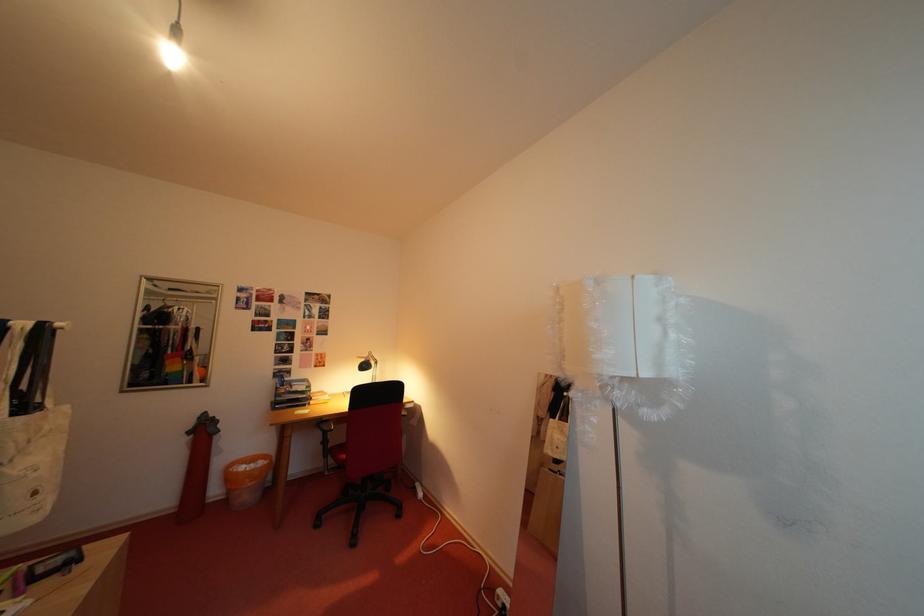
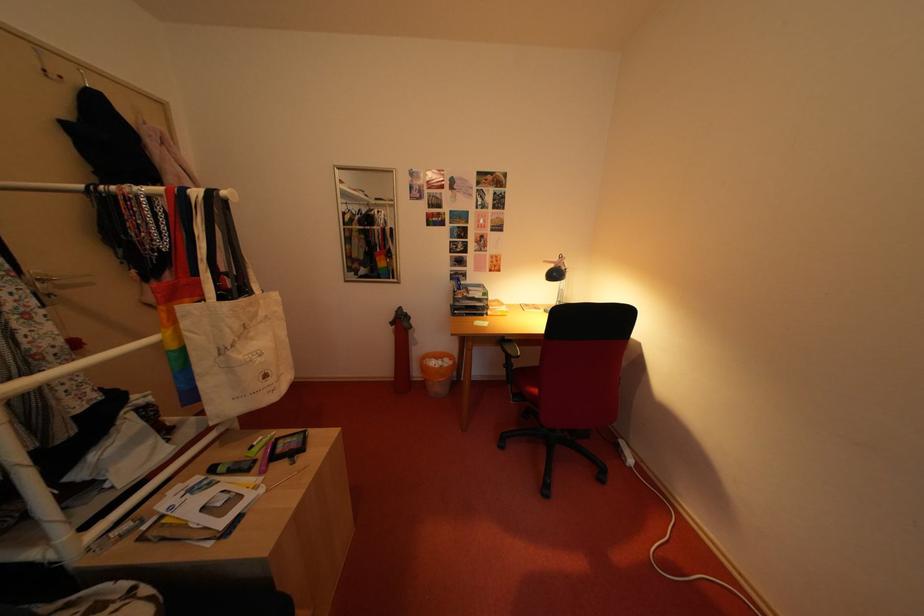
Find the pixel in the second image that matches pixel 45 498 in the first image.

(275, 381)